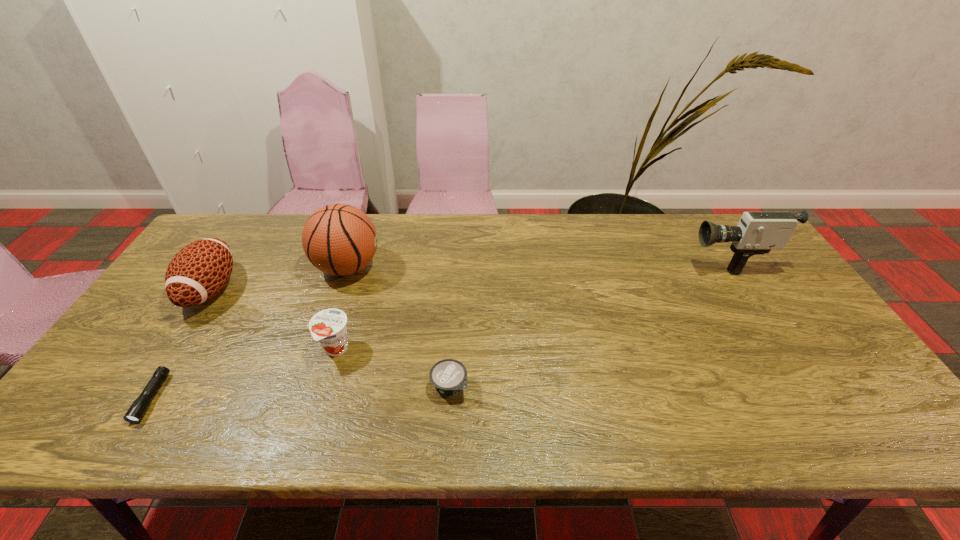
What are the coordinates of `unoccupied position between the basketball and the shortest object` in the screenshot? It's located at (250, 333).

Where is `free spot between the fourth shortest object and the rightmost object`? free spot between the fourth shortest object and the rightmost object is located at coordinates (468, 274).

You are a GUI agent. You are given a task and a screenshot of the screen. Output one action in this format:
    pyautogui.click(x=<x>, y=<y>)
    Task: Click on the empty space between the football and the flashlight
    The image size is (960, 540).
    Given the screenshot: What is the action you would take?
    pyautogui.click(x=181, y=343)

The height and width of the screenshot is (540, 960). What are the coordinates of `free point between the flashlight and the third shortest object` in the screenshot? It's located at (244, 374).

Where is `vacant area between the farther yogurt and the basketball`? The image size is (960, 540). vacant area between the farther yogurt and the basketball is located at coordinates (342, 308).

Image resolution: width=960 pixels, height=540 pixels. I want to click on empty location between the shortest object and the fourth farthest object, so click(244, 374).

The width and height of the screenshot is (960, 540). I want to click on empty space between the flashlight and the second shortest object, so click(300, 392).

Select which object is the second closest to the nearer yogurt. Please provide its 2D coordinates. Your answer should be formatted as a tuple, i.e. [(x, y)], where the tuple contains the x and y coordinates of a point satisfying the conditions above.

[(339, 239)]

At what (x,y) coordinates should I click in order to perform the action: click on the second closest object to the fourth farthest object. Please return your answer as a coordinate pair (x, y). Looking at the image, I should click on (449, 376).

Where is `vacant area in the image that satisfies the following two spatial constraints: 1. on the recording direction of the rightmost object; 2. on the front side of the left yogurt`? The image size is (960, 540). vacant area in the image that satisfies the following two spatial constraints: 1. on the recording direction of the rightmost object; 2. on the front side of the left yogurt is located at coordinates (783, 349).